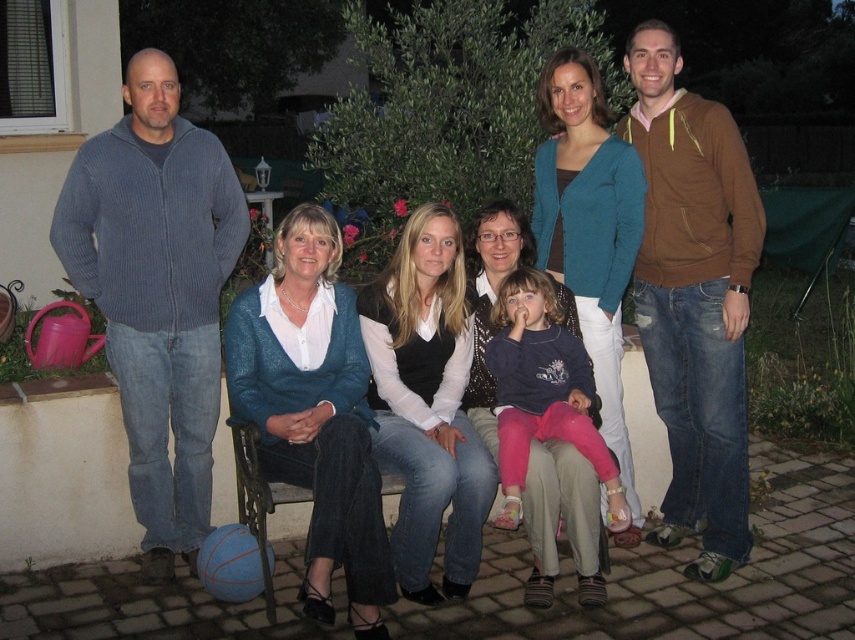
Can you confirm if blue ribbed sweater at left is smaller than matte blue sweater at center?

No, blue ribbed sweater at left is not smaller than matte blue sweater at center.

Can you confirm if blue ribbed sweater at left is positioned to the left of matte blue sweater at center?

Indeed, blue ribbed sweater at left is positioned on the left side of matte blue sweater at center.

Is point (175, 369) positioned after point (497, 525)?

Yes, it is behind point (497, 525).

You are a GUI agent. You are given a task and a screenshot of the screen. Output one action in this format:
    pyautogui.click(x=<x>, y=<y>)
    Task: Click on the blue ribbed sweater at left
    The image size is (855, 640).
    Given the screenshot: What is the action you would take?
    pyautogui.click(x=157, y=292)

Can you confirm if blue ribbed sweater at left is bigger than brown hoodie at right?

Actually, blue ribbed sweater at left might be smaller than brown hoodie at right.

I want to click on blue ribbed sweater at left, so click(x=157, y=292).

Does point (84, 269) come closer to viewer compared to point (674, 184)?

Yes, point (84, 269) is closer to viewer.

Find the location of a particular element. This screenshot has width=855, height=640. blue ribbed sweater at left is located at coordinates (157, 292).

Find the location of a particular element. Image resolution: width=855 pixels, height=640 pixels. brown hoodie at right is located at coordinates (694, 298).

Can you confirm if brown hoodie at right is taller than matte blue sweater at center?

Correct, brown hoodie at right is much taller as matte blue sweater at center.

Is point (716, 522) positioned after point (544, 282)?

No, it is in front of (544, 282).

You are a GUI agent. You are given a task and a screenshot of the screen. Output one action in this format:
    pyautogui.click(x=<x>, y=<y>)
    Task: Click on the brown hoodie at right
    This screenshot has width=855, height=640.
    Given the screenshot: What is the action you would take?
    pyautogui.click(x=694, y=298)